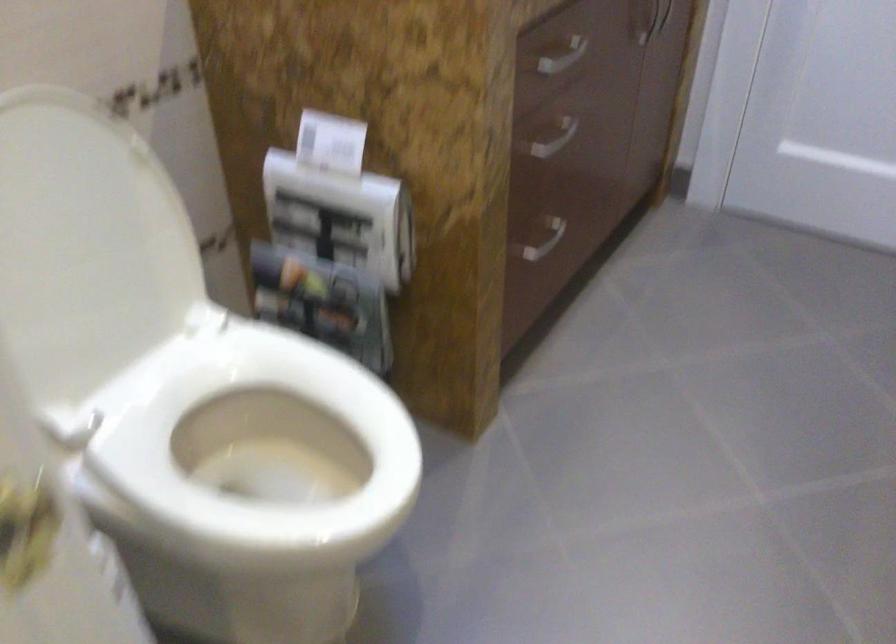
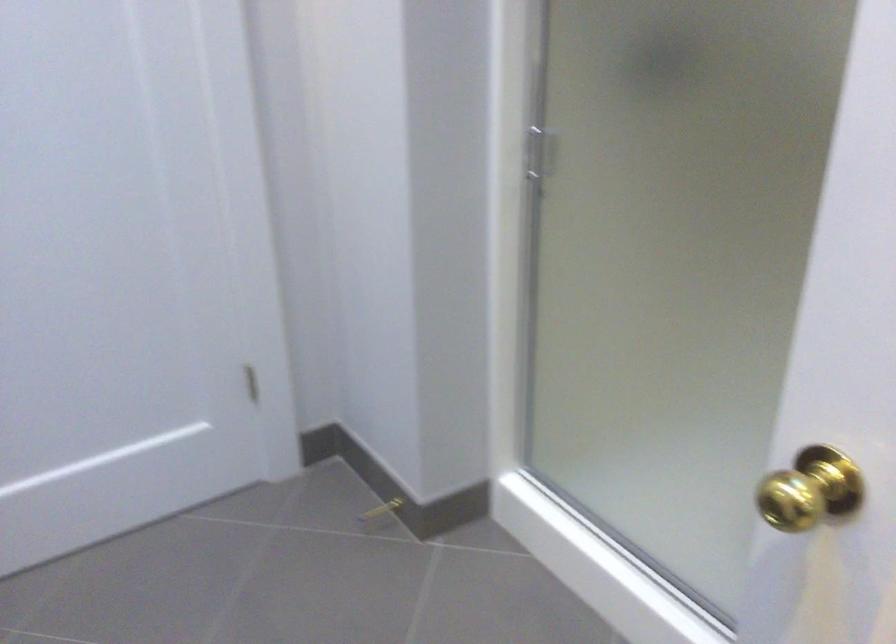
Question: The camera is either moving clockwise (left) or counter-clockwise (right) around the object. The first image is from the beginning of the video and the second image is from the end. Is the camera moving left or right when shooting the video?

Choices:
 (A) Left
 (B) Right

Answer: (A)